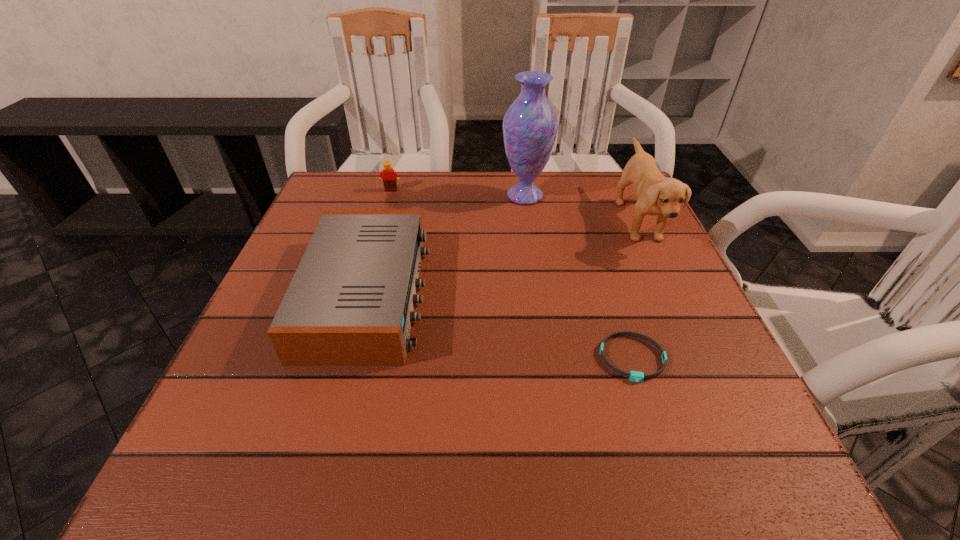
Find the location of a particular element. The image size is (960, 540). puppy that is positioned at the right edge is located at coordinates (656, 194).

This screenshot has width=960, height=540. What are the coordinates of `wristband that is positioned at the right edge` in the screenshot? It's located at (635, 376).

In order to click on object situated at the far left corner in this screenshot , I will do `click(390, 176)`.

Where is `object that is at the far right corner`? This screenshot has width=960, height=540. object that is at the far right corner is located at coordinates (656, 194).

In the image, there is a desktop. Identify the location of vacant space at the far edge. (500, 196).

Identify the location of blank space at the near edge of the desktop. This screenshot has height=540, width=960. (386, 438).

Identify the location of free space at the right edge of the desktop. The image size is (960, 540). (668, 350).

I want to click on vacant region at the far left corner of the desktop, so click(315, 205).

Locate an element on the screen. This screenshot has height=540, width=960. blank space at the far right corner of the desktop is located at coordinates (602, 217).

The image size is (960, 540). What are the coordinates of `free space between the Lego and the rightmost object` in the screenshot? It's located at pyautogui.click(x=515, y=206).